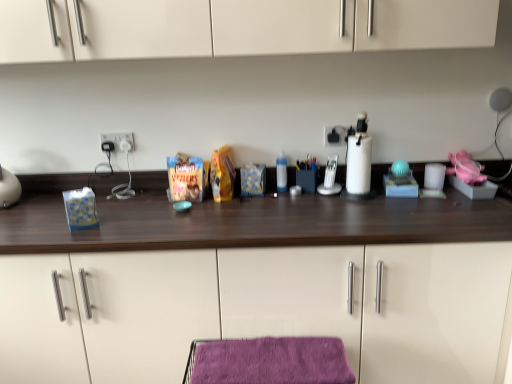
Question: In the image, is white plastic electric outlet at center, the 2th electric outlet positioned from the right, on the left side or the right side of transparent plastic bottle at center?

Choices:
 (A) left
 (B) right

Answer: (A)

Question: Considering the positions of point (123, 145) and point (278, 188), is point (123, 145) closer or farther from the camera than point (278, 188)?

Choices:
 (A) closer
 (B) farther

Answer: (B)

Question: Estimate the real-world distances between objects in this image. Which object is farther from the white plastic electric outlet at center, the 2th electric outlet positioned from the right?

Choices:
 (A) silver metallic phone at center
 (B) purple velvet towel at lower center
 (C) black plastic electric outlet at upper center, the 1th electric outlet in the right-to-left sequence
 (D) transparent plastic bottle at center
 (E) wooden countertop at center

Answer: (B)

Question: Which of these objects is positioned farthest from the transparent plastic bottle at center?

Choices:
 (A) white plastic electric outlet at center, the 1th electric outlet when ordered from left to right
 (B) purple velvet towel at lower center
 (C) silver metallic phone at center
 (D) wooden countertop at center
 (E) black plastic electric outlet at upper center, the 1th electric outlet in the right-to-left sequence

Answer: (D)